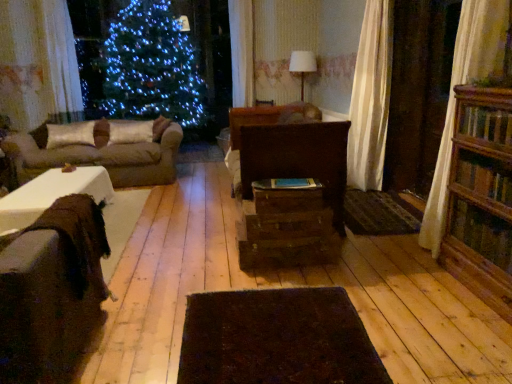
Locate an element on the screen. vacant space in front of wooden bookcase at right is located at coordinates (477, 336).